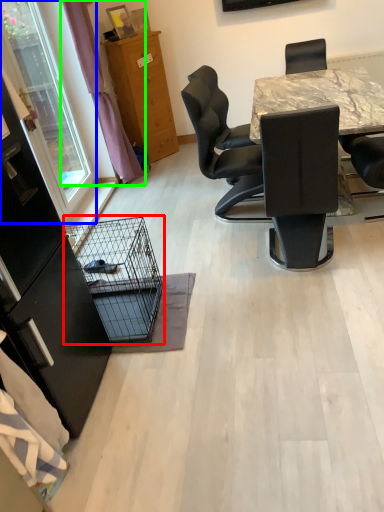
Question: Based on their relative distances, which object is farther from bird cage (highlighted by a red box)? Choose from window screen (highlighted by a blue box) and curtain (highlighted by a green box).

Choices:
 (A) window screen
 (B) curtain

Answer: (B)